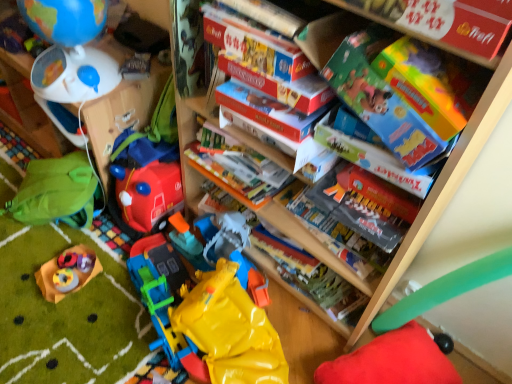
The height and width of the screenshot is (384, 512). What do you see at coordinates (210, 306) in the screenshot?
I see `yellow rubber toy at lower center, marked as the second toy in a right-to-left arrangement` at bounding box center [210, 306].

The width and height of the screenshot is (512, 384). What do you see at coordinates (281, 85) in the screenshot?
I see `matte cardboard box at upper center, which is the third book from back to front` at bounding box center [281, 85].

Describe the element at coordinates (28, 108) in the screenshot. I see `white plastic cup at upper left, positioned as the first shelf in back-to-front order` at that location.

What is the approximate height of white plastic cup at upper left, positioned as the first shelf in back-to-front order?

white plastic cup at upper left, positioned as the first shelf in back-to-front order, is 9.43 inches in height.

Image resolution: width=512 pixels, height=384 pixels. Describe the element at coordinates (67, 272) in the screenshot. I see `rubberized yellow toy at lower left, which appears as the 3th toy when viewed from the left` at that location.

What is the approximate height of hardcover book at center, which ranks as the 4th book in front-to-back order?

hardcover book at center, which ranks as the 4th book in front-to-back order, is 4.82 inches tall.

Image resolution: width=512 pixels, height=384 pixels. Identify the location of yellow rubber toy at lower center, marked as the second toy in a right-to-left arrangement. (210, 306).

Measure the distance between hardcover book at center, placed as the 1th book when sorted from back to front, and red plush cushion at lower right, which ranks as the sixth toy in left-to-right order.

A distance of 9.03 inches exists between hardcover book at center, placed as the 1th book when sorted from back to front, and red plush cushion at lower right, which ranks as the sixth toy in left-to-right order.

Is point (305, 269) behind point (357, 358)?

That is True.

Considering the relative positions of hardcover book at center, which ranks as the 4th book in front-to-back order, and red plush cushion at lower right, the 1th toy from the right, in the image provided, is hardcover book at center, which ranks as the 4th book in front-to-back order, to the right of red plush cushion at lower right, the 1th toy from the right, from the viewer's perspective?

Incorrect, hardcover book at center, which ranks as the 4th book in front-to-back order, is not on the right side of red plush cushion at lower right, the 1th toy from the right.

From the image's perspective, is hardcover book at center, which ranks as the 4th book in front-to-back order, over red plush cushion at lower right, the 1th toy from the right?

Indeed, from the image's perspective, hardcover book at center, which ranks as the 4th book in front-to-back order, is shown above red plush cushion at lower right, the 1th toy from the right.

Based on their positions, is hardcover book at center, which ranks as the 4th book in front-to-back order, located to the left or right of white plastic cup at upper left, which is counted as the first shelf, starting from the left?

From the image, it's evident that hardcover book at center, which ranks as the 4th book in front-to-back order, is to the right of white plastic cup at upper left, which is counted as the first shelf, starting from the left.

Can you see hardcover book at center, which ranks as the 4th book in front-to-back order, touching white plastic cup at upper left, positioned as the first shelf in back-to-front order?

No, hardcover book at center, which ranks as the 4th book in front-to-back order, is not in contact with white plastic cup at upper left, positioned as the first shelf in back-to-front order.

Is hardcover book at center, placed as the 1th book when sorted from back to front, thinner than white plastic cup at upper left, which appears as the second shelf when viewed from the front?

No, hardcover book at center, placed as the 1th book when sorted from back to front, is not thinner than white plastic cup at upper left, which appears as the second shelf when viewed from the front.

Starting from the hardcover book at center, which ranks as the 4th book in front-to-back order, which shelf is the 2nd one to the left? Please provide its 2D coordinates.

[(28, 108)]

Considering the sizes of white plastic cup at upper left, which appears as the second shelf when viewed from the front, and matte gray book at center, which is the second book from back to front, in the image, is white plastic cup at upper left, which appears as the second shelf when viewed from the front, wider or thinner than matte gray book at center, which is the second book from back to front,?

Considering their sizes, white plastic cup at upper left, which appears as the second shelf when viewed from the front, looks slimmer than matte gray book at center, which is the second book from back to front.

Is white plastic cup at upper left, which appears as the second shelf when viewed from the front, positioned with its back to matte gray book at center, which is the second book from back to front?

No, white plastic cup at upper left, which appears as the second shelf when viewed from the front, is not facing away from matte gray book at center, which is the second book from back to front.

How different are the orientations of white plastic cup at upper left, positioned as the first shelf in back-to-front order, and matte gray book at center, marked as the third book in a front-to-back arrangement, in degrees?

white plastic cup at upper left, positioned as the first shelf in back-to-front order, and matte gray book at center, marked as the third book in a front-to-back arrangement, are facing 5.23 degrees away from each other.

From the image's perspective, is white plastic cup at upper left, which is counted as the first shelf, starting from the left, on top of matte gray book at center, which is the second book from back to front?

Yes, from the image's perspective, white plastic cup at upper left, which is counted as the first shelf, starting from the left, is over matte gray book at center, which is the second book from back to front.

Locate an element on the screen. The height and width of the screenshot is (384, 512). the 1st shelf above the hardcover book at center, placed as the 1th book when sorted from back to front (from the image's perspective) is located at coordinates (122, 112).

Is hardcover book at center, placed as the 1th book when sorted from back to front, positioned behind green fabric backpack at left, the first shelf from the front?

Yes, hardcover book at center, placed as the 1th book when sorted from back to front, is further from the viewer.

In terms of height, does hardcover book at center, placed as the 1th book when sorted from back to front, look taller or shorter compared to green fabric backpack at left, positioned as the second shelf in left-to-right order?

Considering their sizes, hardcover book at center, placed as the 1th book when sorted from back to front, has less height than green fabric backpack at left, positioned as the second shelf in left-to-right order.

From a real-world perspective, between hardcover book at center, placed as the 1th book when sorted from back to front, and green fabric backpack at left, positioned as the second shelf in left-to-right order, who is vertically lower?

In real-world perspective, hardcover book at center, placed as the 1th book when sorted from back to front, is lower.

From a real-world perspective, is white plastic cup at upper left, which is counted as the first shelf, starting from the left, physically above green fabric backpack at lower left, which ranks as the 5th toy in right-to-left order?

Yes, from a real-world perspective, white plastic cup at upper left, which is counted as the first shelf, starting from the left, is above green fabric backpack at lower left, which ranks as the 5th toy in right-to-left order.

I want to click on the 2nd toy in front of the white plastic cup at upper left, which is counted as the first shelf, starting from the left, starting your count from the anchor, so (x=56, y=192).

From the image's perspective, relative to green fabric backpack at lower left, arranged as the second toy when viewed from the left, is white plastic cup at upper left, which appears as the second shelf when viewed from the front, above or below?

white plastic cup at upper left, which appears as the second shelf when viewed from the front, is above green fabric backpack at lower left, arranged as the second toy when viewed from the left.

Is white plastic cup at upper left, which appears as the second shelf when viewed from the front, to the left of green fabric backpack at lower left, arranged as the second toy when viewed from the left, from the viewer's perspective?

Yes.

Is green fabric backpack at lower left, which ranks as the 5th toy in right-to-left order, thinner than red plush cushion at lower right, which ranks as the sixth toy in left-to-right order?

Correct, the width of green fabric backpack at lower left, which ranks as the 5th toy in right-to-left order, is less than that of red plush cushion at lower right, which ranks as the sixth toy in left-to-right order.

From a real-world perspective, is green fabric backpack at lower left, which ranks as the 5th toy in right-to-left order, located higher than red plush cushion at lower right, the 1th toy from the right?

Yes.

Does red plastic toy car at lower left, which ranks as the third toy in right-to-left order, turn towards hardcover book at center, placed as the 1th book when sorted from back to front?

No, red plastic toy car at lower left, which ranks as the third toy in right-to-left order, is not aimed at hardcover book at center, placed as the 1th book when sorted from back to front.

Is red plastic toy car at lower left, which ranks as the third toy in right-to-left order, positioned far away from hardcover book at center, placed as the 1th book when sorted from back to front?

That's not correct — red plastic toy car at lower left, which ranks as the third toy in right-to-left order, is a little close to hardcover book at center, placed as the 1th book when sorted from back to front.

Is hardcover book at center, placed as the 1th book when sorted from back to front, surrounded by red plastic toy car at lower left, which ranks as the third toy in right-to-left order?

No, hardcover book at center, placed as the 1th book when sorted from back to front, is not inside red plastic toy car at lower left, which ranks as the third toy in right-to-left order.

Between red plastic toy car at lower left, which ranks as the third toy in right-to-left order, and hardcover book at center, placed as the 1th book when sorted from back to front, which one has larger width?

With larger width is hardcover book at center, placed as the 1th book when sorted from back to front.

Locate an element on the screen. The image size is (512, 384). toy that is the 4th one below the hardcover book at center, placed as the 1th book when sorted from back to front (from a real-world perspective) is located at coordinates (392, 361).

There is a white plastic cup at upper left, which appears as the second shelf when viewed from the front. Where is `the 4th book below it (from the image's perspective)`? the 4th book below it (from the image's perspective) is located at coordinates pos(311,277).

From the image, which object appears to be farther from red plush cushion at lower right, which ranks as the sixth toy in left-to-right order, rubberized yellow toy at lower left, placed as the 4th toy when sorted from right to left, or green fabric backpack at left, positioned as the second shelf in left-to-right order?

green fabric backpack at left, positioned as the second shelf in left-to-right order, is further to red plush cushion at lower right, which ranks as the sixth toy in left-to-right order.

When comparing their distances from red plastic toy car at lower left, placed as the 4th toy when sorted from left to right, does red plush cushion at lower right, the 1th toy from the right, or green fabric backpack at lower left, arranged as the second toy when viewed from the left, seem closer?

green fabric backpack at lower left, arranged as the second toy when viewed from the left, is positioned closer to the anchor red plastic toy car at lower left, placed as the 4th toy when sorted from left to right.

Consider the image. When comparing their distances from green fabric backpack at left, positioned as the second shelf in left-to-right order, does green fabric backpack at lower left, which ranks as the 5th toy in right-to-left order, or white plastic cup at upper left, positioned as the first shelf in back-to-front order, seem further?

The object further to green fabric backpack at left, positioned as the second shelf in left-to-right order, is white plastic cup at upper left, positioned as the first shelf in back-to-front order.

Considering their positions, is red plush cushion at lower right, which ranks as the sixth toy in left-to-right order, positioned closer to matte blue globe at upper left, marked as the 6th toy in a right-to-left arrangement, than matte cardboard box at upper center, which is the third book from back to front?

The object closer to matte blue globe at upper left, marked as the 6th toy in a right-to-left arrangement, is matte cardboard box at upper center, which is the third book from back to front.

Based on their spatial positions, is rubberized yellow toy at lower left, placed as the 4th toy when sorted from right to left, or white plastic cup at upper left, positioned as the first shelf in back-to-front order, closer to hardcover book at center, placed as the 1th book when sorted from back to front?

Among the two, rubberized yellow toy at lower left, placed as the 4th toy when sorted from right to left, is located nearer to hardcover book at center, placed as the 1th book when sorted from back to front.

From the image, which object appears to be farther from red plush cushion at lower right, the 1th toy from the right, red plastic toy car at lower left, placed as the 4th toy when sorted from left to right, or green fabric backpack at left, positioned as the second shelf in left-to-right order?

green fabric backpack at left, positioned as the second shelf in left-to-right order.

Estimate the real-world distances between objects in this image. Which object is closer to red plush cushion at lower right, the 1th toy from the right, white plastic cup at upper left, which appears as the second shelf when viewed from the front, or matte cardboard box at upper center, which is the third book from back to front?

The object closer to red plush cushion at lower right, the 1th toy from the right, is matte cardboard box at upper center, which is the third book from back to front.

When comparing their distances from hardcover book at center, which ranks as the 4th book in front-to-back order, does matte blue globe at upper left, marked as the 6th toy in a right-to-left arrangement, or green fabric backpack at lower left, arranged as the second toy when viewed from the left, seem further?

Based on the image, matte blue globe at upper left, marked as the 6th toy in a right-to-left arrangement, appears to be further to hardcover book at center, which ranks as the 4th book in front-to-back order.

In order to click on shelf between green fabric backpack at lower left, arranged as the second toy when viewed from the left, and hardcover book at center, which ranks as the 4th book in front-to-back order, in the horizontal direction in this screenshot , I will do `click(122, 112)`.

Locate an element on the screen. This screenshot has height=384, width=512. toy situated between red plastic toy car at lower left, placed as the 4th toy when sorted from left to right, and hardcover book at center, which ranks as the 4th book in front-to-back order, from left to right is located at coordinates (210, 306).

Where is `shelf between rubberized yellow toy at lower left, which appears as the 3th toy when viewed from the left, and matte cardboard box at upper center, which is the 2th book from front to back, from left to right`? The width and height of the screenshot is (512, 384). shelf between rubberized yellow toy at lower left, which appears as the 3th toy when viewed from the left, and matte cardboard box at upper center, which is the 2th book from front to back, from left to right is located at coordinates (122, 112).

The width and height of the screenshot is (512, 384). Find the location of `book located between rubberized yellow toy at lower left, which appears as the 3th toy when viewed from the left, and hardcover book at center, placed as the 1th book when sorted from back to front, in the left-right direction`. book located between rubberized yellow toy at lower left, which appears as the 3th toy when viewed from the left, and hardcover book at center, placed as the 1th book when sorted from back to front, in the left-right direction is located at coordinates (281, 85).